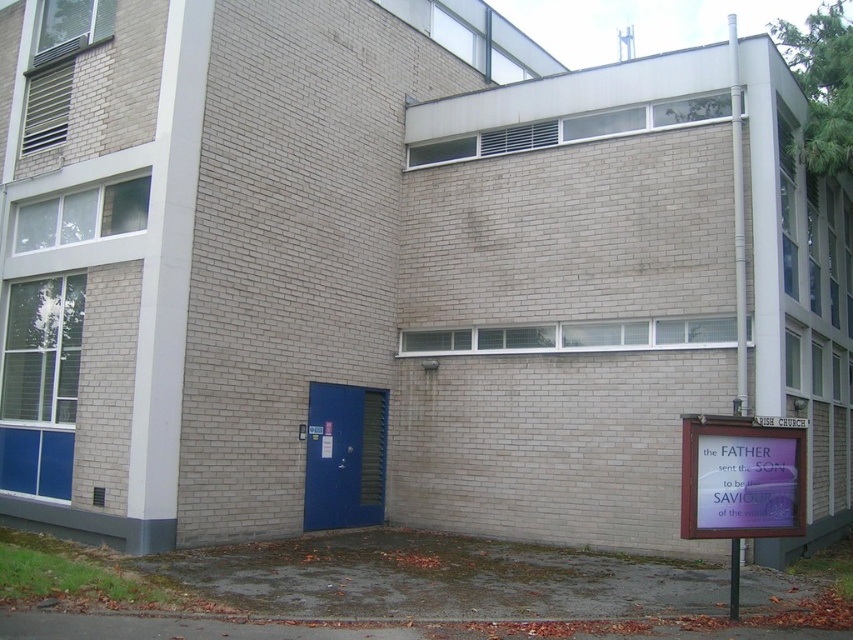
Consider the image. Who is higher up, purple glossy sign at lower right or blue matte door at center?

Positioned higher is purple glossy sign at lower right.

Does purple glossy sign at lower right have a greater height compared to blue matte door at center?

Incorrect, purple glossy sign at lower right's height is not larger of blue matte door at center's.

Between point (759, 435) and point (386, 420), which one is positioned in front?

Point (759, 435) is more forward.

Find the location of a particular element. Image resolution: width=853 pixels, height=640 pixels. purple glossy sign at lower right is located at coordinates (740, 477).